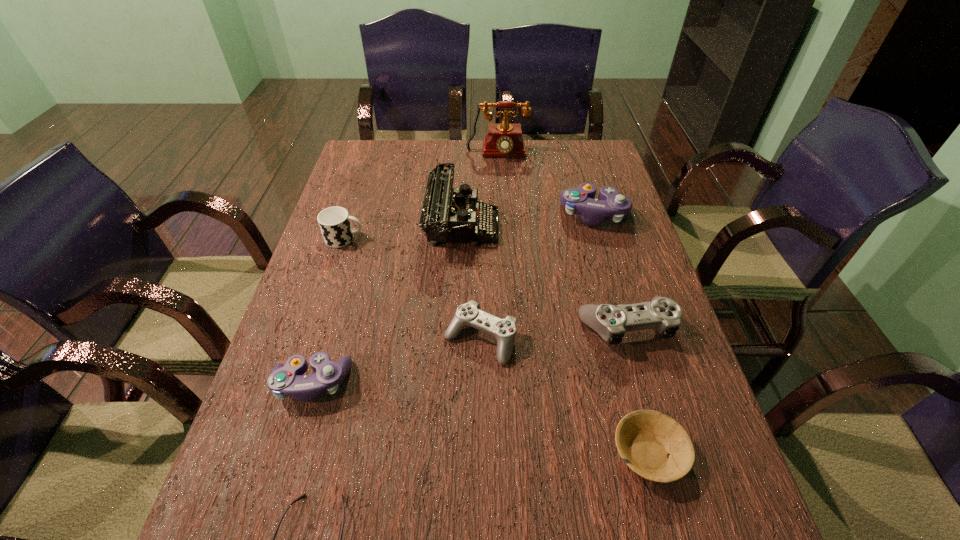
Find the location of a particular element. The width and height of the screenshot is (960, 540). free spot between the right white control and the nearer purple control is located at coordinates (468, 355).

This screenshot has width=960, height=540. What are the coordinates of `vacant region between the third control from right to left and the tallest object` in the screenshot? It's located at (489, 247).

At what (x,y) coordinates should I click in order to perform the action: click on vacant point located between the shortest control and the farthest object. Please return your answer as a coordinate pair (x, y). Looking at the image, I should click on (489, 247).

Locate which object is the sixth closest to the cup. Please provide its 2D coordinates. Your answer should be formatted as a tuple, i.e. [(x, y)], where the tuple contains the x and y coordinates of a point satisfying the conditions above.

[(611, 322)]

Choose which object is the second nearest neighbor to the bowl. Please provide its 2D coordinates. Your answer should be formatted as a tuple, i.e. [(x, y)], where the tuple contains the x and y coordinates of a point satisfying the conditions above.

[(468, 314)]

Where is `control that stands as the third closest to the nearest object`? control that stands as the third closest to the nearest object is located at coordinates (611, 322).

Select which control is the closest to the second control from left to right. Please provide its 2D coordinates. Your answer should be formatted as a tuple, i.e. [(x, y)], where the tuple contains the x and y coordinates of a point satisfying the conditions above.

[(611, 322)]

Identify the location of free point that satisfies the following two spatial constraints: 1. on the keyboard of the eighth shortest object; 2. on the left side of the left white control. (456, 339).

Where is `vacant point that satisfies the following two spatial constraints: 1. on the back side of the farther purple control; 2. on the right side of the smaller purple control`? vacant point that satisfies the following two spatial constraints: 1. on the back side of the farther purple control; 2. on the right side of the smaller purple control is located at coordinates (362, 215).

Image resolution: width=960 pixels, height=540 pixels. I want to click on free space that satisfies the following two spatial constraints: 1. on the side of the second nearest object with the handle; 2. on the left side of the cup, so click(x=275, y=453).